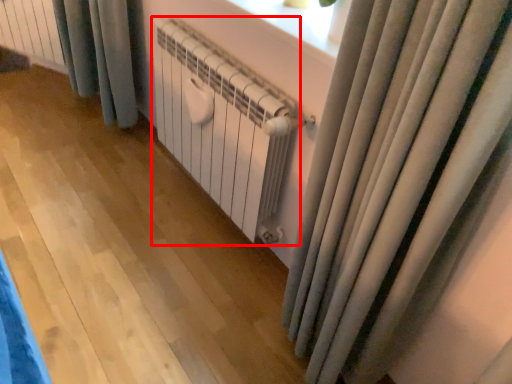
Question: Where is radiator (annotated by the red box) located in relation to radiator in the image?

Choices:
 (A) right
 (B) left

Answer: (A)